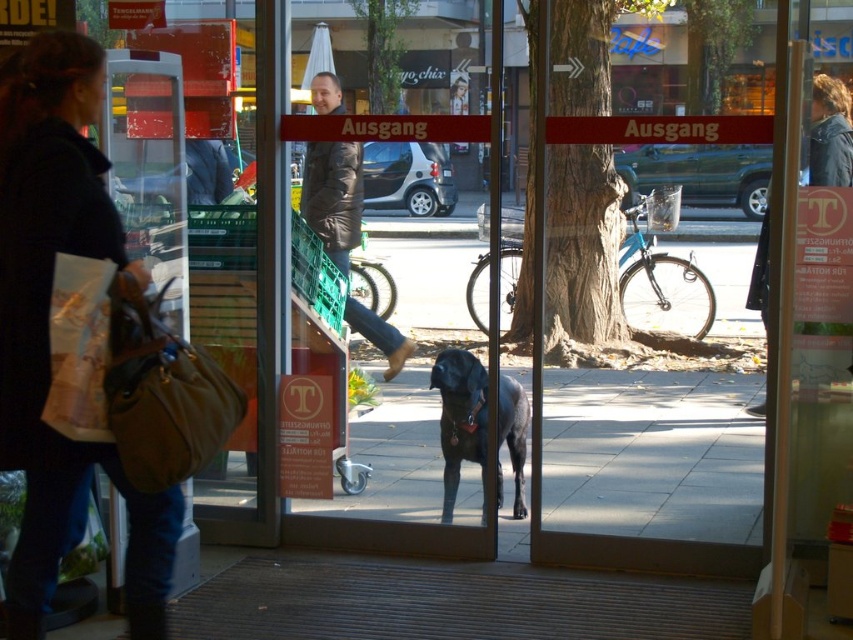
Is brown leather jacket at center taller than dark brown leather jacket at upper right?

Correct, brown leather jacket at center is much taller as dark brown leather jacket at upper right.

Is point (328, 208) farther from viewer compared to point (842, 138)?

Yes, point (328, 208) is behind point (842, 138).

Where is `brown leather jacket at center`? brown leather jacket at center is located at coordinates (334, 196).

In the scene shown: Is dark blue jeans at lower left bigger than shiny black dog at center?

Indeed, dark blue jeans at lower left has a larger size compared to shiny black dog at center.

Measure the distance between dark blue jeans at lower left and shiny black dog at center.

dark blue jeans at lower left is 6.86 feet away from shiny black dog at center.

Which is behind, point (90, 52) or point (463, 406)?

Positioned behind is point (463, 406).

You are a GUI agent. You are given a task and a screenshot of the screen. Output one action in this format:
    pyautogui.click(x=<x>, y=<y>)
    Task: Click on the dark blue jeans at lower left
    
    Given the screenshot: What is the action you would take?
    pyautogui.click(x=49, y=330)

From the picture: Is brown leather jacket at center smaller than shiny black dog at center?

Actually, brown leather jacket at center might be larger than shiny black dog at center.

What do you see at coordinates (334, 196) in the screenshot?
I see `brown leather jacket at center` at bounding box center [334, 196].

Who is more forward, (322, 188) or (459, 428)?

Positioned in front is point (459, 428).

This screenshot has width=853, height=640. Find the location of `brown leather jacket at center`. brown leather jacket at center is located at coordinates (334, 196).